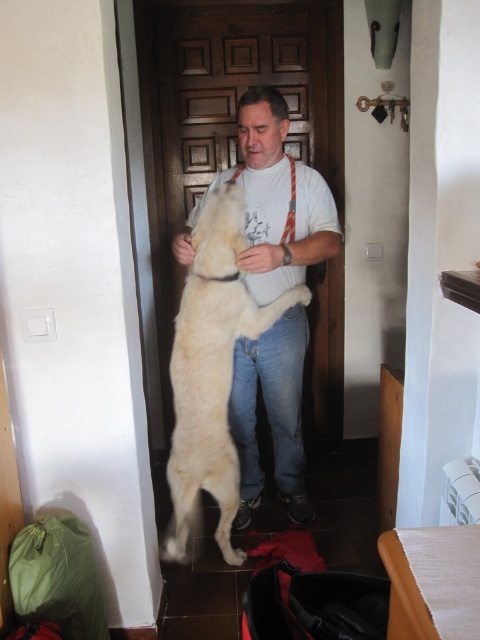
You are a dog trainer observing the scene. The man is holding the light beige fur at center and standing near the beige fabric lift at lower right. Which object is taller in this image?

The light beige fur at center is much taller than the beige fabric lift at lower right.

You are an interior designer analyzing the image of a hallway. You need to place a decorative item exactly at the coordinates mentioned in the description of the light beige fur at center. Where should you place the item in relation to the man and the dog?

The light beige fur at center is located at point (211,376), so the decorative item should be placed at that coordinate, which is near the man and the dog since they are at the center of the image.